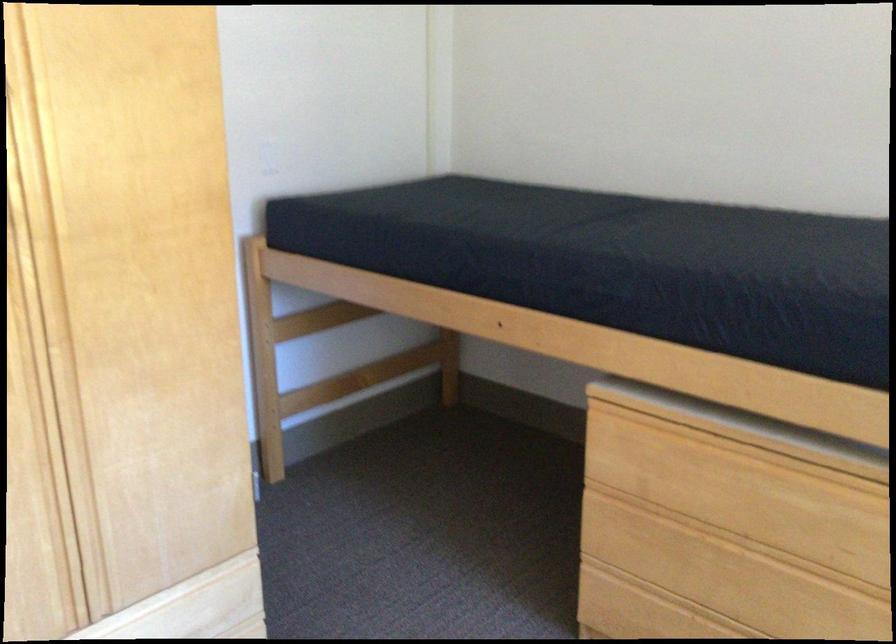
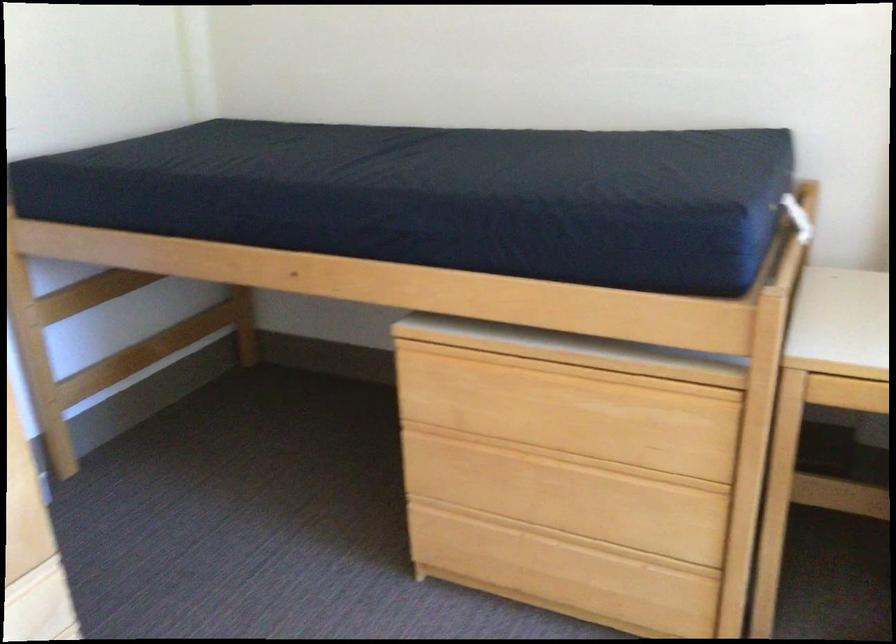
Question: The images are taken continuously from a first-person perspective. In which direction are you moving?

Choices:
 (A) Left
 (B) Right
 (C) Forward
 (D) Backward

Answer: (C)